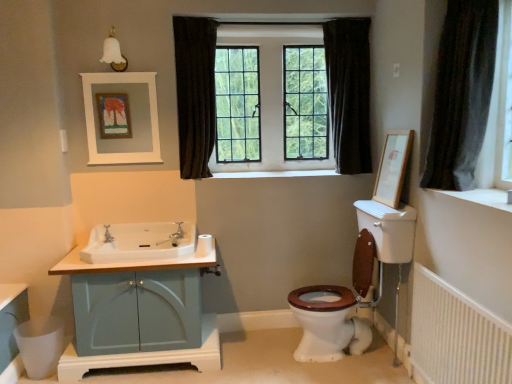
Question: Is clear glass windows at center far away from matte silver faucet at center, the first tap positioned from the right?

Choices:
 (A) no
 (B) yes

Answer: (B)

Question: Could you tell me if clear glass windows at center is turned towards matte silver faucet at center, the first tap positioned from the right?

Choices:
 (A) yes
 (B) no

Answer: (B)

Question: Is clear glass windows at center facing away from matte silver faucet at center, the first tap positioned from the right?

Choices:
 (A) no
 (B) yes

Answer: (A)

Question: Does clear glass windows at center come behind matte silver faucet at center, the first tap positioned from the right?

Choices:
 (A) no
 (B) yes

Answer: (B)

Question: Is clear glass windows at center shorter than matte silver faucet at center, which is the second tap from left to right?

Choices:
 (A) no
 (B) yes

Answer: (A)

Question: In the image, is white glossy sink at center left positioned in front of or behind white textured radiator at lower right?

Choices:
 (A) front
 (B) behind

Answer: (B)

Question: Considering the positions of white glossy sink at center left and white textured radiator at lower right in the image, is white glossy sink at center left taller or shorter than white textured radiator at lower right?

Choices:
 (A) tall
 (B) short

Answer: (B)

Question: Looking at their shapes, would you say white glossy sink at center left is wider or thinner than white textured radiator at lower right?

Choices:
 (A) wide
 (B) thin

Answer: (A)

Question: From the image's perspective, is white glossy sink at center left above or below white textured radiator at lower right?

Choices:
 (A) above
 (B) below

Answer: (A)

Question: From the image's perspective, is dark fabric curtain at center, positioned as the first curtain in back-to-front order, above or below matte silver faucet at center, which is the second tap from left to right?

Choices:
 (A) above
 (B) below

Answer: (A)

Question: From a real-world perspective, relative to matte silver faucet at center, which is the second tap from left to right, is dark fabric curtain at center, positioned as the first curtain in back-to-front order, vertically above or below?

Choices:
 (A) below
 (B) above

Answer: (B)

Question: Is dark fabric curtain at center, positioned as the 2th curtain in left-to-right order, to the left or to the right of matte silver faucet at center, which is the second tap from left to right, in the image?

Choices:
 (A) left
 (B) right

Answer: (B)

Question: Is dark fabric curtain at center, positioned as the first curtain in back-to-front order, bigger or smaller than matte silver faucet at center, the first tap positioned from the right?

Choices:
 (A) big
 (B) small

Answer: (A)

Question: Considering the positions of white textured radiator at lower right and matte silver faucet at center, which is the second tap from left to right, in the image, is white textured radiator at lower right wider or thinner than matte silver faucet at center, which is the second tap from left to right,?

Choices:
 (A) wide
 (B) thin

Answer: (B)

Question: Looking at the image, does white textured radiator at lower right seem bigger or smaller compared to matte silver faucet at center, the first tap positioned from the right?

Choices:
 (A) small
 (B) big

Answer: (B)